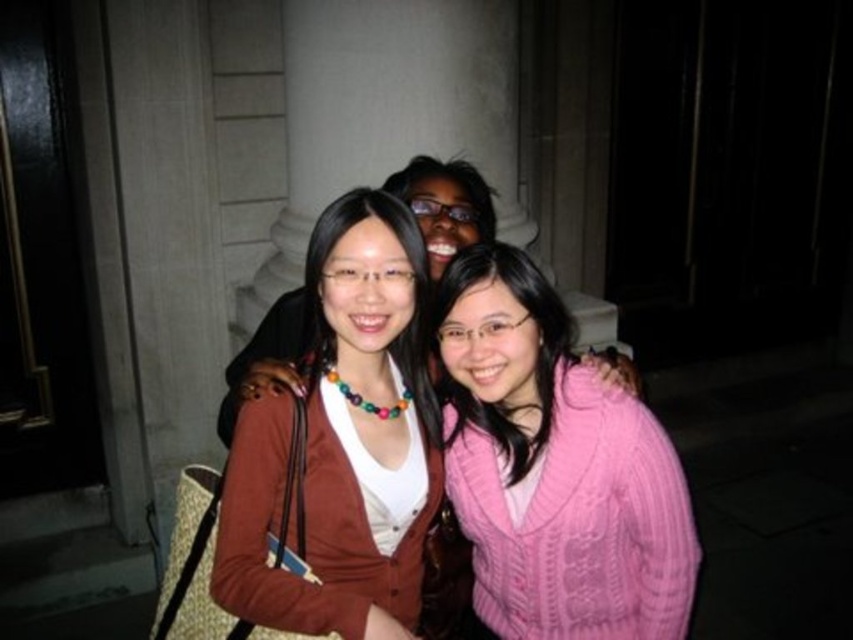
Based on the photo, you are a photographer taking a group photo of the pink knitted sweater at center and the brown matte sweater at center. Which sweater should you adjust to ensure both are fully visible in the frame?

The pink knitted sweater at center is to the right of the brown matte sweater at center, so you should adjust the pink knitted sweater at center to move it slightly to the left to ensure both are fully visible in the frame.

Please describe the location of the pink knitted sweater at center in the image using the coordinate system provided. The coordinate system has its origin at the bottom left corner of the image, with x increasing to the right and y increasing upwards. The coordinates are given as a pair of values between 0 and 1.

The pink knitted sweater at center is located at the coordinate point of 0.733 on the x axis and 0.651 on the y axis.